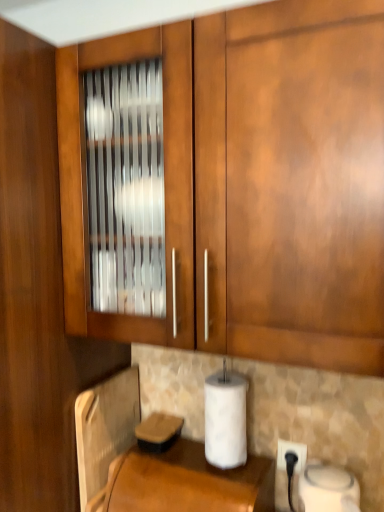
Question: Based on their sizes in the image, would you say brown leather at lower center is bigger or smaller than white plastic electric outlet at lower right?

Choices:
 (A) small
 (B) big

Answer: (B)

Question: Looking at their shapes, would you say brown leather at lower center is wider or thinner than white plastic electric outlet at lower right?

Choices:
 (A) wide
 (B) thin

Answer: (A)

Question: Which object is the farthest from the metallic silver toaster at lower left?

Choices:
 (A) brown leather at lower center
 (B) white matte paper towel at lower center
 (C) glossy wood cabinet at upper left
 (D) white plastic electric outlet at lower right

Answer: (C)

Question: Based on their relative distances, which object is farther from the metallic silver toaster at lower left?

Choices:
 (A) glossy wood cabinet at upper left
 (B) white matte paper towel at lower center
 (C) white plastic electric outlet at lower right
 (D) brown leather at lower center

Answer: (A)